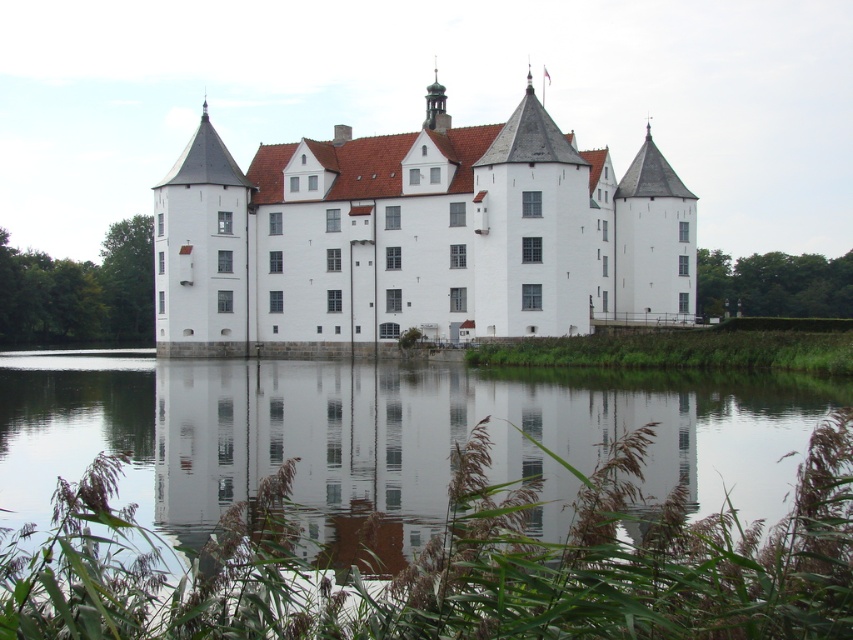
Can you confirm if transparent glass water at center is wider than white stone castle at center?

Correct, the width of transparent glass water at center exceeds that of white stone castle at center.

Who is lower down, transparent glass water at center or white stone castle at center?

transparent glass water at center

Is point (109, 534) positioned behind point (347, 176)?

No, it is in front of (347, 176).

Image resolution: width=853 pixels, height=640 pixels. I want to click on transparent glass water at center, so click(x=415, y=502).